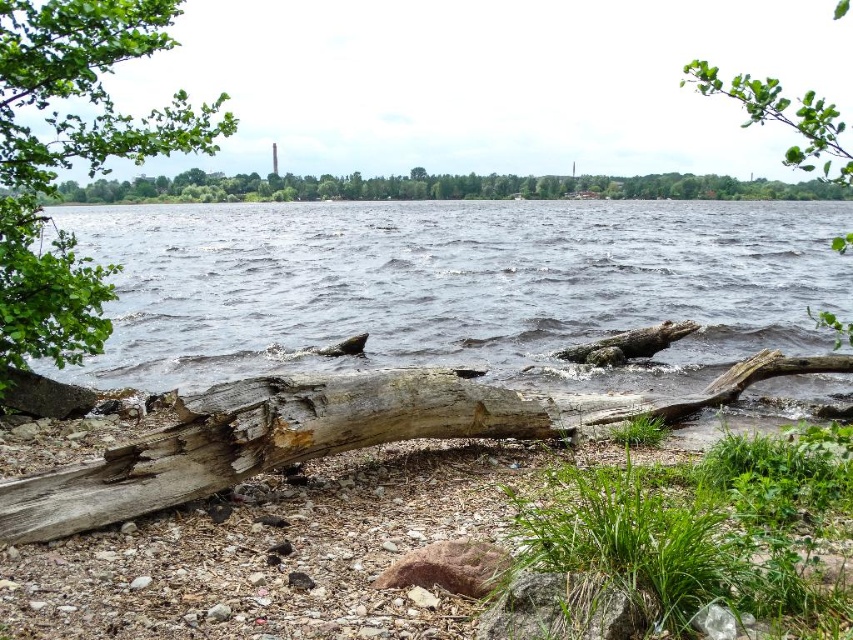
Question: Can you confirm if dark blue water at center is positioned to the right of green leafy tree at upper left?

Choices:
 (A) yes
 (B) no

Answer: (A)

Question: Does dark blue water at center appear under green leafy tree at upper center?

Choices:
 (A) no
 (B) yes

Answer: (B)

Question: Which object is closer to the camera taking this photo?

Choices:
 (A) weathered wood log at center
 (B) weathered wood log at lower center
 (C) dark blue water at center
 (D) green leafy tree at upper left

Answer: (B)

Question: Can you confirm if dark blue water at center is thinner than green leafy tree at upper center?

Choices:
 (A) no
 (B) yes

Answer: (B)

Question: Among these points, which one is nearest to the camera?

Choices:
 (A) (200, 172)
 (B) (38, 29)

Answer: (B)

Question: Which point is closer to the camera?

Choices:
 (A) (207, 307)
 (B) (822, 189)
 (C) (0, 225)
 (D) (560, 355)

Answer: (C)